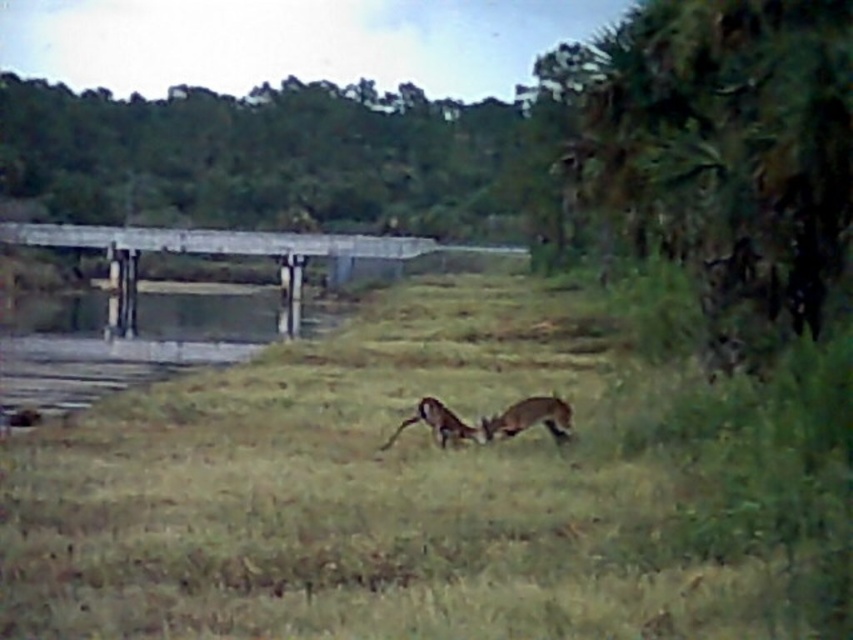
You are a wildlife photographer trying to capture a photo of the brown furry dog at center and the brown furry antelope at center. You want to ensure both animals are clearly visible in the frame. Based on their sizes, which animal should you focus on first to ensure proper focus?

The brown furry antelope at center is larger than the brown furry dog at center, so you should focus on the brown furry antelope at center first to ensure proper focus.

You are standing at the edge of the grassy area and want to throw a small stone to hit the green grass at center. Considering the distance, can you reach it with a single throw?

The green grass at center is 20.33 feet away from you, so yes, you can reach it with a single throw since the average throwing distance for a small stone is around 20 to 30 feet.